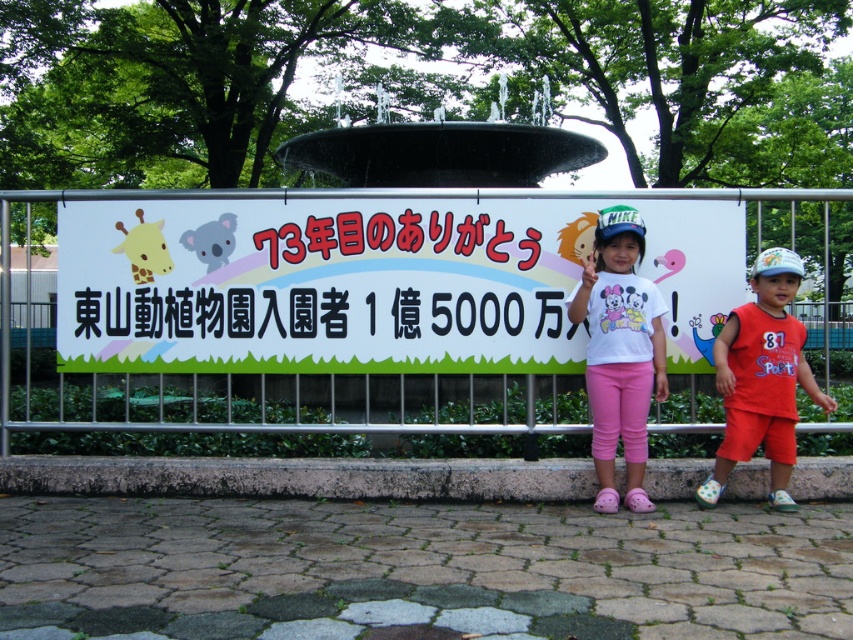
Does pink fabric pants at center lie behind white cotton shirt at center?

Yes, it is behind white cotton shirt at center.

Does pink fabric pants at center have a greater height compared to white cotton shirt at center?

Yes.

Is point (659, 390) closer to viewer compared to point (648, 506)?

No, (659, 390) is further to viewer.

At what (x,y) coordinates should I click in order to perform the action: click on pink fabric pants at center. Please return your answer as a coordinate pair (x, y). Looking at the image, I should click on (619, 349).

Does point (637, 240) come in front of point (737, 397)?

No.

Who is lower down, pink fabric pants at center or orange cotton shorts at right?

orange cotton shorts at right

Does point (625, 314) lie behind point (749, 401)?

Yes, it is behind point (749, 401).

The image size is (853, 640). Identify the location of pink fabric pants at center. (619, 349).

Between point (471, 300) and point (614, 509), which one is positioned in front?

Point (614, 509) is more forward.

The width and height of the screenshot is (853, 640). What are the coordinates of `white paper sign at center` in the screenshot? It's located at (321, 284).

This screenshot has height=640, width=853. Identify the location of white paper sign at center. (321, 284).

You are a GUI agent. You are given a task and a screenshot of the screen. Output one action in this format:
    pyautogui.click(x=<x>, y=<y>)
    Task: Click on the white paper sign at center
    This screenshot has width=853, height=640.
    Given the screenshot: What is the action you would take?
    pyautogui.click(x=321, y=284)